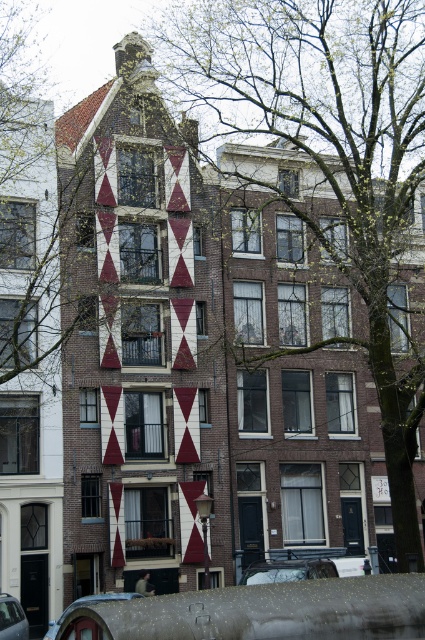
Can you confirm if metallic silver car at lower center is thinner than metallic silver car at lower left?

No.

In the scene shown: Which of these two, metallic silver car at lower center or metallic silver car at lower left, stands taller?

Standing taller between the two is metallic silver car at lower center.

Is point (274, 564) positioned in front of point (17, 625)?

No, it is not.

The height and width of the screenshot is (640, 425). In order to click on metallic silver car at lower center in this screenshot , I will do `click(289, 570)`.